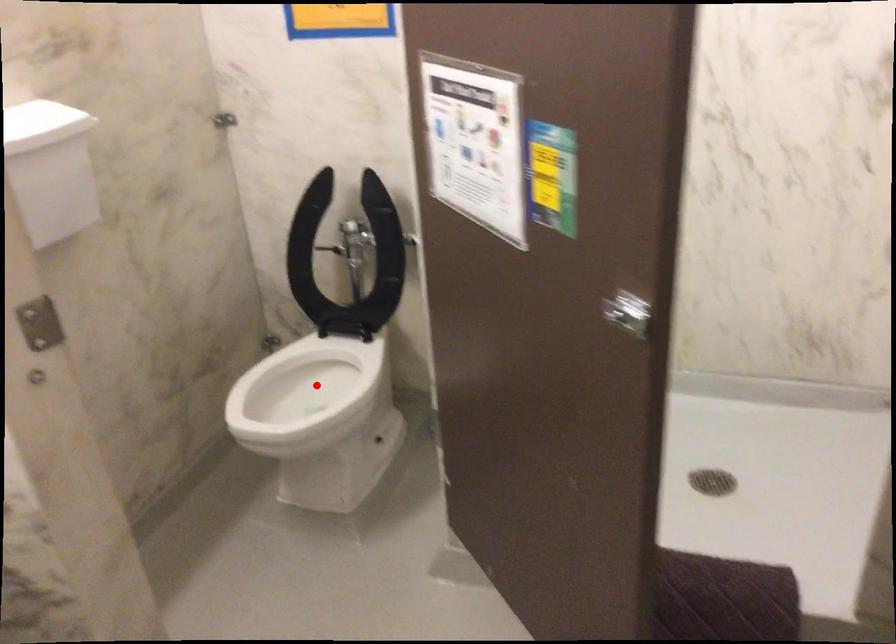
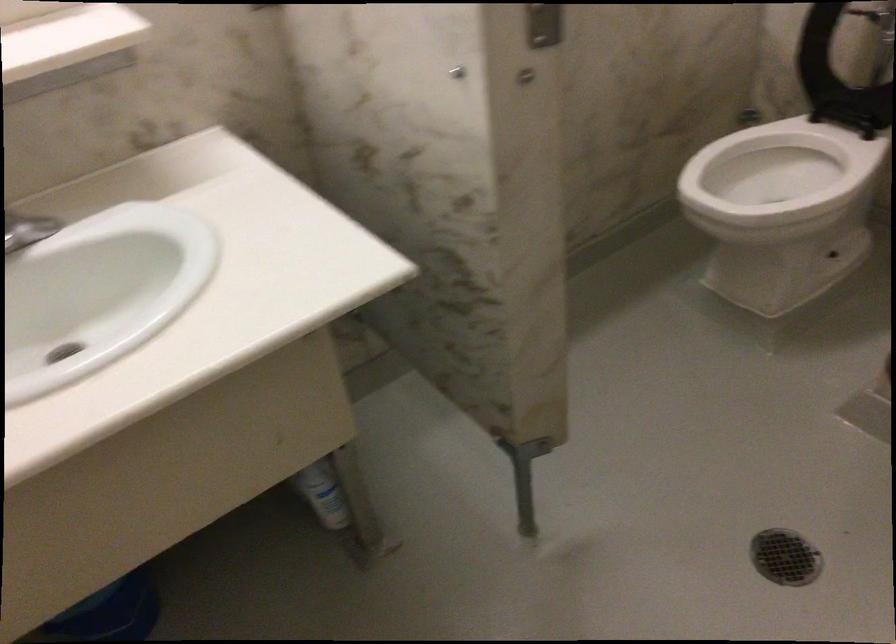
Find the pixel in the second image that matches the highlighted location in the first image.

(778, 173)